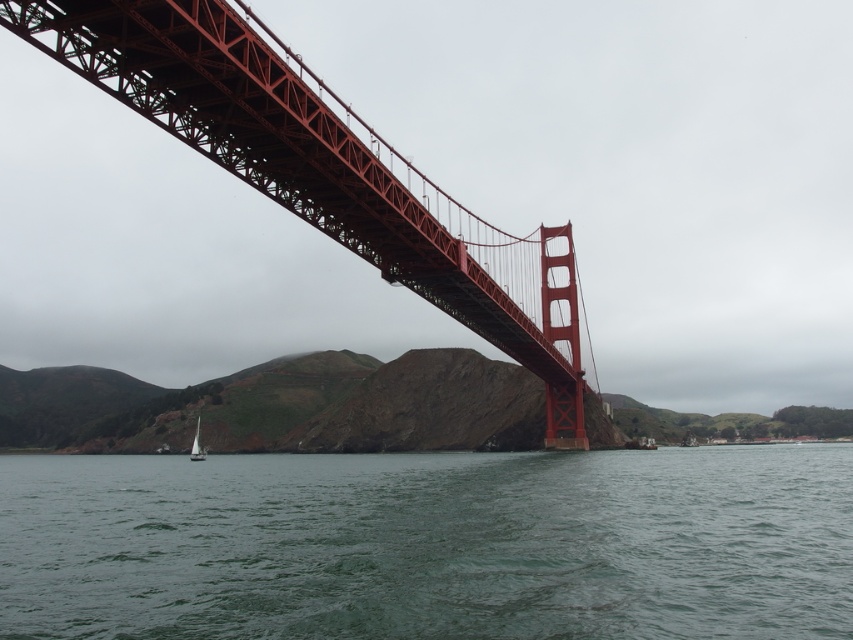
Between green water at lower center and red steel suspension bridge at upper center, which one appears on the right side from the viewer's perspective?

red steel suspension bridge at upper center

Between green water at lower center and red steel suspension bridge at upper center, which one is positioned higher?

red steel suspension bridge at upper center

Who is more forward, (390, 589) or (332, 188)?

Point (390, 589) is in front.

Where is `green water at lower center`? green water at lower center is located at coordinates (428, 545).